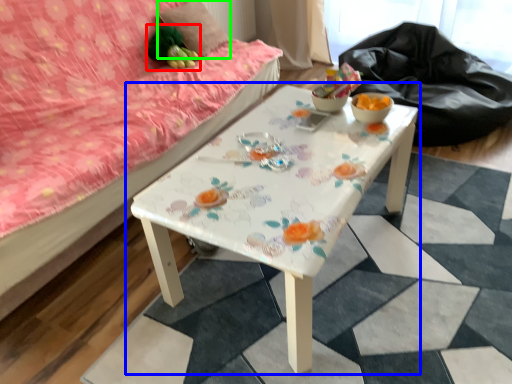
Question: Based on their relative distances, which object is farther from toy (highlighted by a red box)? Choose from table (highlighted by a blue box) and pillow (highlighted by a green box).

Choices:
 (A) table
 (B) pillow

Answer: (A)